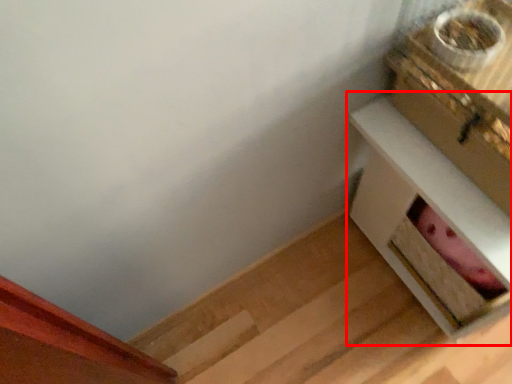
Question: Observing the image, what is the correct spatial positioning of table (annotated by the red box) in reference to box?

Choices:
 (A) left
 (B) right

Answer: (B)